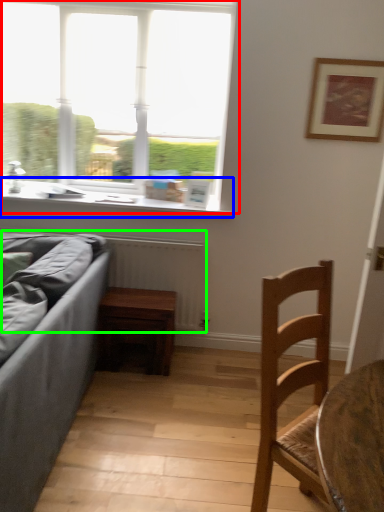
Question: Based on their relative distances, which object is farther from window (highlighted by a red box)? Choose from window sill (highlighted by a blue box) and radiator (highlighted by a green box).

Choices:
 (A) window sill
 (B) radiator

Answer: (B)